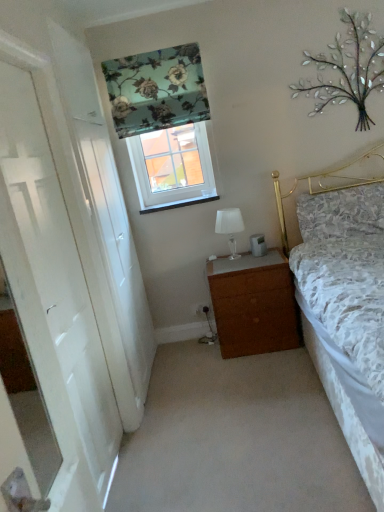
Question: Considering the relative positions of brown wood chest of drawers at center and white plastic window at upper center in the image provided, is brown wood chest of drawers at center to the right of white plastic window at upper center from the viewer's perspective?

Choices:
 (A) no
 (B) yes

Answer: (B)

Question: Is brown wood chest of drawers at center to the left of white plastic window at upper center from the viewer's perspective?

Choices:
 (A) yes
 (B) no

Answer: (B)

Question: Can you confirm if brown wood chest of drawers at center is wider than white plastic window at upper center?

Choices:
 (A) yes
 (B) no

Answer: (A)

Question: From a real-world perspective, is brown wood chest of drawers at center located beneath white plastic window at upper center?

Choices:
 (A) no
 (B) yes

Answer: (B)

Question: Is the surface of brown wood chest of drawers at center in direct contact with white plastic window at upper center?

Choices:
 (A) no
 (B) yes

Answer: (A)

Question: Could white plastic window at upper center be considered to be inside brown wood chest of drawers at center?

Choices:
 (A) yes
 (B) no

Answer: (B)

Question: Can you confirm if white plastic window at upper center is taller than floral fabric curtain at upper center?

Choices:
 (A) yes
 (B) no

Answer: (A)

Question: Is floral fabric curtain at upper center inside white plastic window at upper center?

Choices:
 (A) yes
 (B) no

Answer: (B)

Question: From the image's perspective, is white plastic window at upper center on floral fabric curtain at upper center?

Choices:
 (A) yes
 (B) no

Answer: (B)

Question: Can you confirm if white plastic window at upper center is wider than floral fabric curtain at upper center?

Choices:
 (A) no
 (B) yes

Answer: (A)

Question: From a real-world perspective, is white plastic window at upper center over floral fabric curtain at upper center?

Choices:
 (A) yes
 (B) no

Answer: (B)

Question: Does white plastic window at upper center come behind floral fabric curtain at upper center?

Choices:
 (A) no
 (B) yes

Answer: (B)

Question: Is floral fabric pillow at upper right far from white glossy door at left?

Choices:
 (A) no
 (B) yes

Answer: (B)